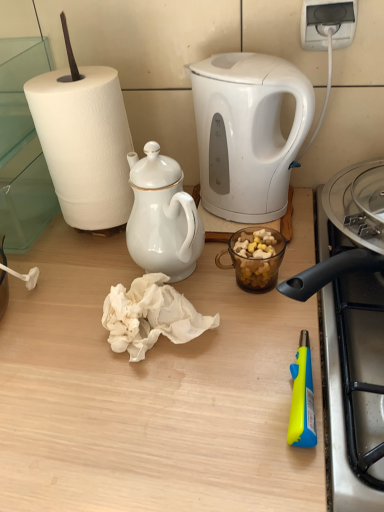
Find the location of a particular element. free spot above white glossy electric kettle at upper center (from a real-world perspective) is located at coordinates (238, 57).